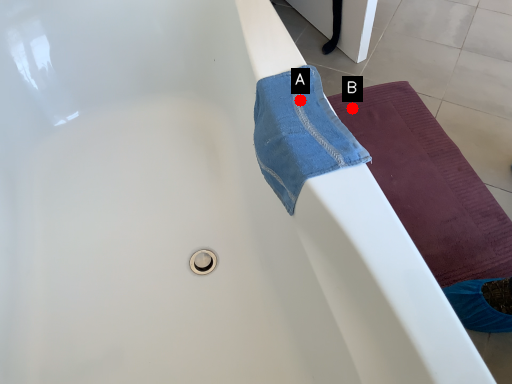
Question: Two points are circled on the image, labeled by A and B beside each circle. Which of the following is the farthest from the observer?

Choices:
 (A) A is further
 (B) B is further

Answer: (B)